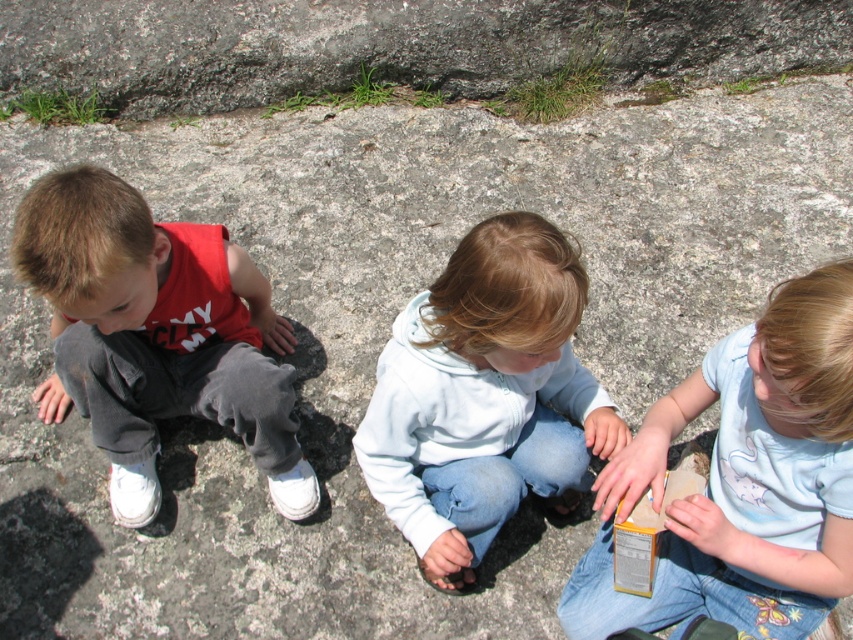
You are a photographer trying to capture a candid shot of the two children in the middle. The light blue cotton shirt at center and the light blue fleece at center are both part of the middle child. Which clothing item is positioned lower on the child?

The light blue cotton shirt at center is positioned lower on the child because it is below the light blue fleece at center.